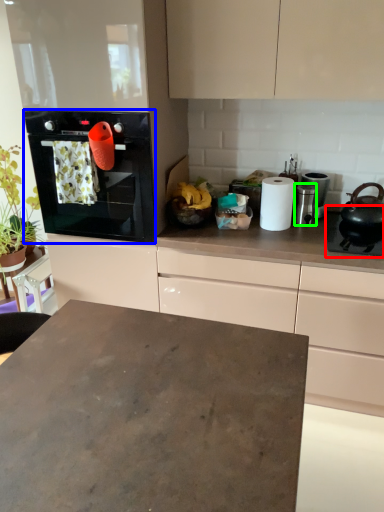
Question: Estimate the real-world distances between objects in this image. Which object is farther from gas stove (highlighted by a red box), home appliance (highlighted by a blue box) or appliance (highlighted by a green box)?

Choices:
 (A) home appliance
 (B) appliance

Answer: (A)